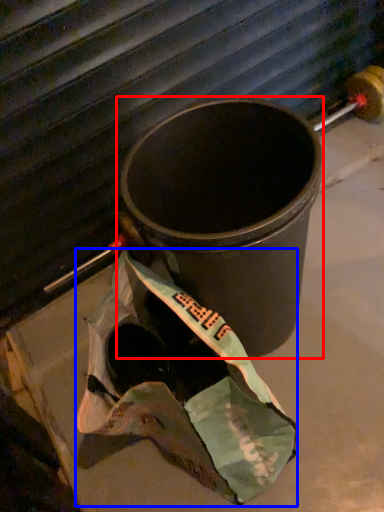
Question: Which object appears farthest to the camera in this image, waste container (highlighted by a red box) or grocery bag (highlighted by a blue box)?

Choices:
 (A) waste container
 (B) grocery bag

Answer: (A)